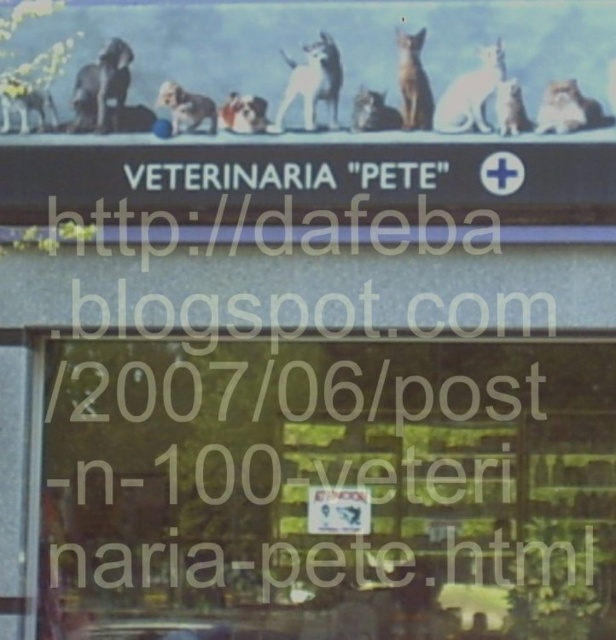
You are standing in front of the veterinary clinic signboard. There is a point marked at coordinates (25, 104). What does this point represent?

The point at coordinates (25, 104) represents the white fur dog at upper left.

You are a customer entering the veterinary clinic and need to place a 18 inch wide pet carrier between the white fur dog at upper left and the white fur dog at center on the signboard. Will the carrier fit between them?

The white fur dog at upper left and white fur dog at center are 19.26 inches apart from each other. Since the pet carrier is 18 inches wide, it will fit between them with some space to spare.